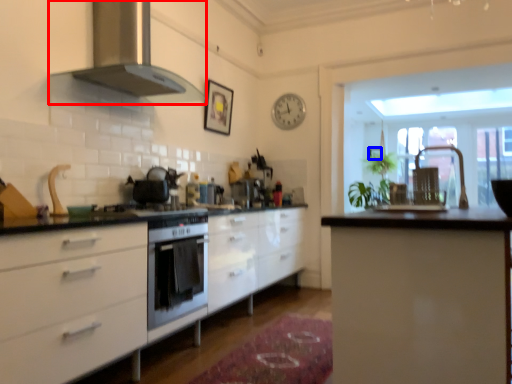
Question: Among these objects, which one is nearest to the camera, home appliance (highlighted by a red box) or picture frame (highlighted by a blue box)?

Choices:
 (A) home appliance
 (B) picture frame

Answer: (A)